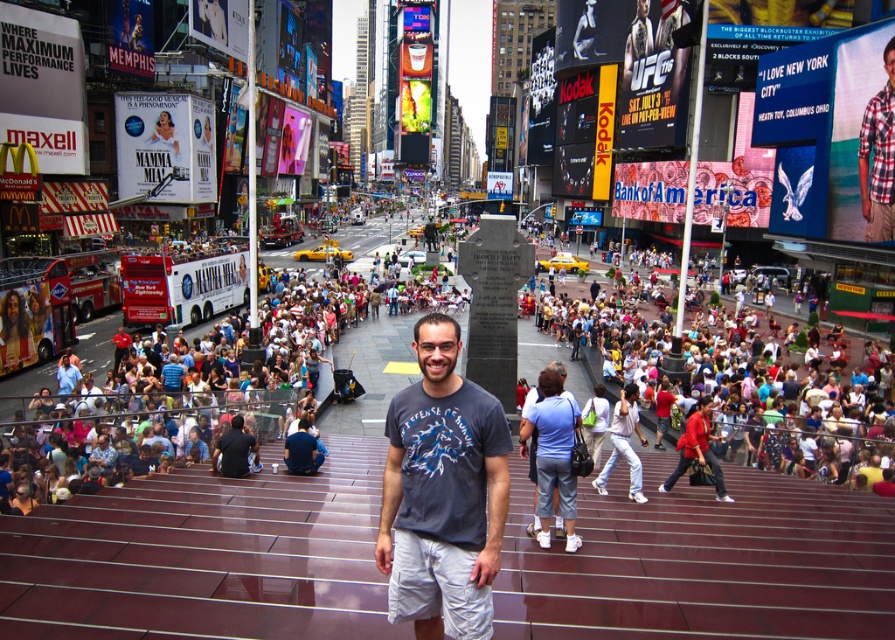
Between point (834, 368) and point (564, 412), which one is positioned in front?

Point (564, 412)

Between point (105, 410) and point (573, 426), which one is positioned in front?

Point (573, 426)

This screenshot has width=895, height=640. Identify the location of multicolored fabric crowd at center. (192, 394).

From the picture: Which is more to the left, light blue denim shorts at center or matte red coat at center?

light blue denim shorts at center is more to the left.

Between point (546, 468) and point (670, 480), which one is positioned in front?

Point (546, 468)

This screenshot has height=640, width=895. In order to click on light blue denim shorts at center in this screenshot , I will do `click(552, 456)`.

Does multicolored fabric crowd at center appear on the right side of matte red coat at center?

Incorrect, multicolored fabric crowd at center is not on the right side of matte red coat at center.

Does multicolored fabric crowd at center have a lesser width compared to matte red coat at center?

No.

Locate an element on the screen. multicolored fabric crowd at center is located at coordinates (192, 394).

This screenshot has width=895, height=640. I want to click on multicolored fabric crowd at center, so click(192, 394).